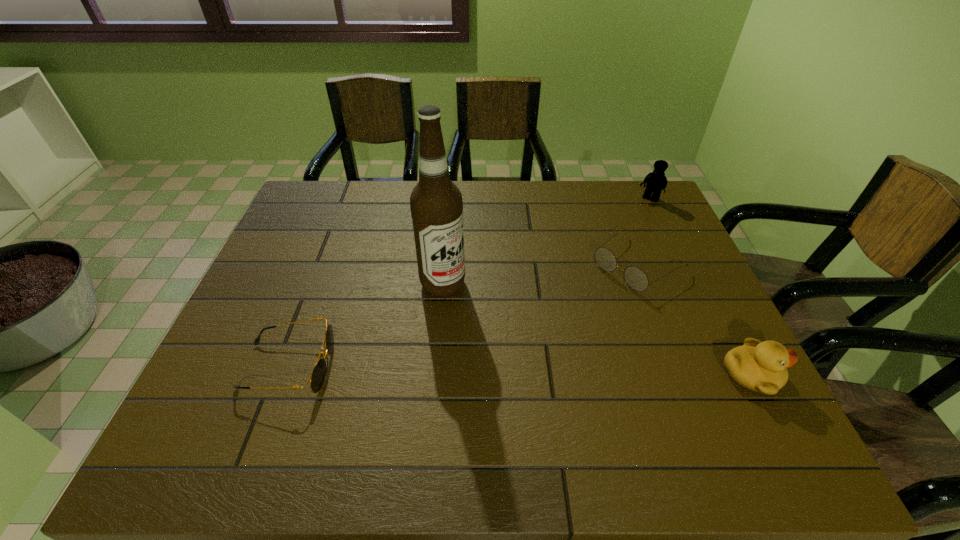
I want to click on the leftmost object, so click(317, 377).

In order to click on duckling in this screenshot , I will do `click(759, 366)`.

Find the location of `spectacles`. spectacles is located at coordinates (635, 277).

This screenshot has height=540, width=960. Find the location of `alcohol`. alcohol is located at coordinates (436, 205).

Locate an element on the screen. the tallest object is located at coordinates (436, 205).

This screenshot has height=540, width=960. Identify the location of Lego. (656, 181).

At what (x,y) coordinates should I click in order to perform the action: click on the farthest object. Please return your answer as a coordinate pair (x, y). Looking at the image, I should click on (656, 181).

At what (x,y) coordinates should I click in order to perform the action: click on vacant area located 0.190m on the lenses of the sunglasses. Please return your answer as a coordinate pair (x, y). The height and width of the screenshot is (540, 960). Looking at the image, I should click on (416, 366).

What are the coordinates of `free region located 0.370m on the temples of the spectacles` in the screenshot? It's located at (507, 359).

The width and height of the screenshot is (960, 540). What are the coordinates of `free space located on the temples of the spectacles` in the screenshot? It's located at (519, 349).